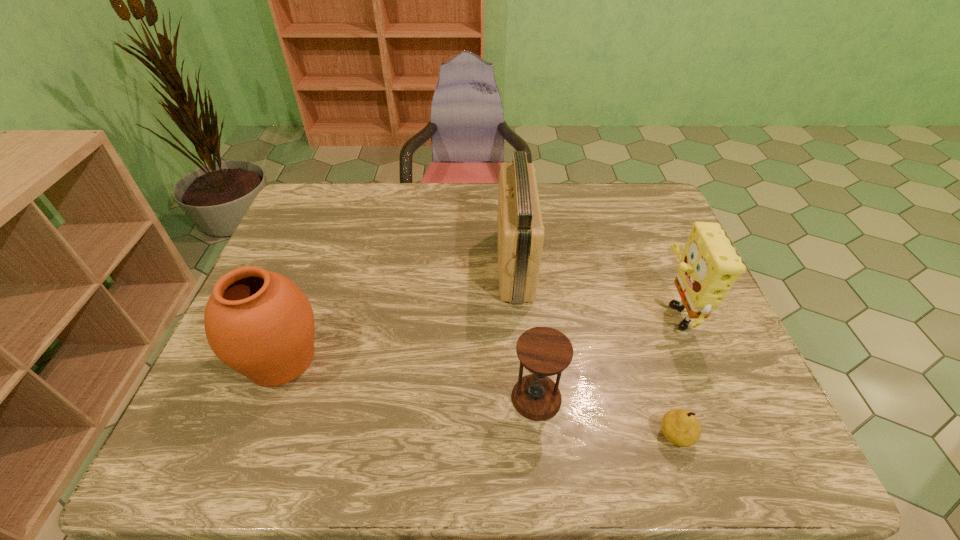
In the image, there is a desktop. At what (x,y) coordinates should I click in order to perform the action: click on vacant space at the right edge. Please return your answer as a coordinate pair (x, y). Looking at the image, I should click on (666, 238).

The width and height of the screenshot is (960, 540). In order to click on free location at the far left corner in this screenshot , I will do `click(341, 202)`.

You are a GUI agent. You are given a task and a screenshot of the screen. Output one action in this format:
    pyautogui.click(x=<x>, y=<y>)
    Task: Click on the free point at the far right corner
    
    Given the screenshot: What is the action you would take?
    pyautogui.click(x=660, y=199)

Locate an element on the screen. This screenshot has width=960, height=540. vacant space in between the leftmost object and the radio receiver is located at coordinates (398, 312).

The image size is (960, 540). What are the coordinates of `vacant space that's between the hourglass and the pear` in the screenshot? It's located at (606, 416).

Image resolution: width=960 pixels, height=540 pixels. I want to click on free spot between the radio receiver and the pear, so click(595, 350).

Where is `vacant region between the sponge and the radio receiver`? The height and width of the screenshot is (540, 960). vacant region between the sponge and the radio receiver is located at coordinates (594, 288).

Find the location of a particular element. The height and width of the screenshot is (540, 960). free point between the leftmost object and the shortest object is located at coordinates (478, 397).

What are the coordinates of `free space between the radio receiver and the second object from right to left` in the screenshot? It's located at coord(595,350).

At what (x,y) coordinates should I click in order to perform the action: click on empty space that is in between the sponge and the shortest object. Please return your answer as a coordinate pair (x, y). The width and height of the screenshot is (960, 540). Looking at the image, I should click on (675, 373).